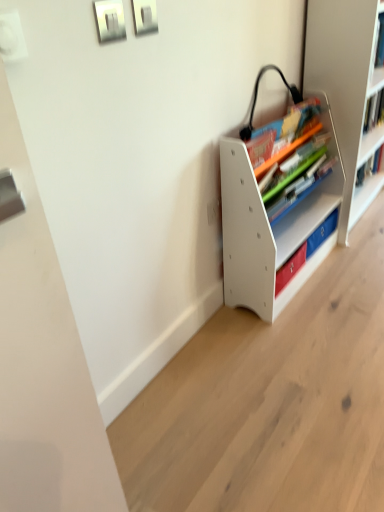
Question: Is white matte bookshelf at center, which is the first shelf from left to right, not inside white plastic bookshelf at right, the first shelf positioned from the right?

Choices:
 (A) no
 (B) yes

Answer: (B)

Question: Is white matte bookshelf at center, the 2th shelf from the right, bigger than white plastic bookshelf at right, the first shelf positioned from the right?

Choices:
 (A) yes
 (B) no

Answer: (B)

Question: Is white matte bookshelf at center, the 2th shelf from the right, smaller than white plastic bookshelf at right, which is counted as the 2th shelf, starting from the left?

Choices:
 (A) no
 (B) yes

Answer: (B)

Question: From the image's perspective, is white matte bookshelf at center, the 2th shelf from the right, located above white plastic bookshelf at right, the first shelf positioned from the right?

Choices:
 (A) yes
 (B) no

Answer: (B)

Question: Is white matte bookshelf at center, which is the first shelf from left to right, thinner than white plastic bookshelf at right, the first shelf positioned from the right?

Choices:
 (A) yes
 (B) no

Answer: (A)

Question: From their relative heights in the image, would you say white plastic bookshelf at right, which is counted as the 2th shelf, starting from the left, is taller or shorter than white matte bookshelf at center, which is the first shelf from left to right?

Choices:
 (A) tall
 (B) short

Answer: (A)

Question: In the image, is white plastic bookshelf at right, the first shelf positioned from the right, on the left side or the right side of white matte bookshelf at center, the 2th shelf from the right?

Choices:
 (A) left
 (B) right

Answer: (B)

Question: From a real-world perspective, is white plastic bookshelf at right, the first shelf positioned from the right, positioned above or below white matte bookshelf at center, which is the first shelf from left to right?

Choices:
 (A) below
 (B) above

Answer: (B)

Question: Considering the positions of white plastic bookshelf at right, which is counted as the 2th shelf, starting from the left, and white matte bookshelf at center, the 2th shelf from the right, in the image, is white plastic bookshelf at right, which is counted as the 2th shelf, starting from the left, wider or thinner than white matte bookshelf at center, the 2th shelf from the right,?

Choices:
 (A) thin
 (B) wide

Answer: (B)

Question: From the image's perspective, is matte plastic books at center located above or below white matte bookshelf at center, the 2th shelf from the right?

Choices:
 (A) above
 (B) below

Answer: (A)

Question: Do you think matte plastic books at center is within white matte bookshelf at center, the 2th shelf from the right, or outside of it?

Choices:
 (A) inside
 (B) outside

Answer: (A)

Question: In the image, is matte plastic books at center on the left side or the right side of white matte bookshelf at center, which is the first shelf from left to right?

Choices:
 (A) left
 (B) right

Answer: (A)

Question: Based on their sizes in the image, would you say matte plastic books at center is bigger or smaller than white matte bookshelf at center, the 2th shelf from the right?

Choices:
 (A) big
 (B) small

Answer: (B)

Question: Relative to matte plastic books at center, is white plastic bookshelf at right, the first shelf positioned from the right, in front or behind?

Choices:
 (A) behind
 (B) front

Answer: (A)

Question: Considering the positions of white plastic bookshelf at right, which is counted as the 2th shelf, starting from the left, and matte plastic books at center in the image, is white plastic bookshelf at right, which is counted as the 2th shelf, starting from the left, taller or shorter than matte plastic books at center?

Choices:
 (A) short
 (B) tall

Answer: (B)